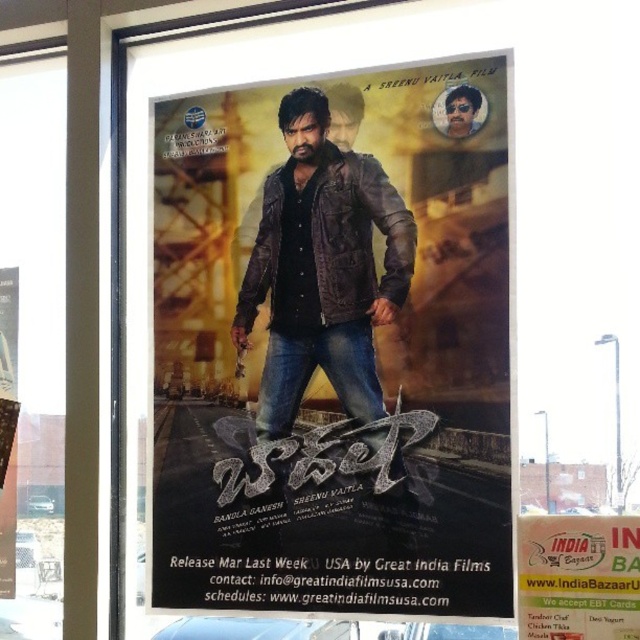
Is leather jacket at center taller than white paper sign at lower right?

Yes, leather jacket at center is taller than white paper sign at lower right.

Does leather jacket at center have a lesser width compared to white paper sign at lower right?

No.

Find the location of a particular element. This screenshot has width=640, height=640. leather jacket at center is located at coordinates (333, 348).

I want to click on leather jacket at center, so tap(333, 348).

Which is in front, point (324, 371) or point (612, 612)?

Positioned in front is point (612, 612).

Does brown leather jacket at center have a greater height compared to white paper sign at lower right?

Correct, brown leather jacket at center is much taller as white paper sign at lower right.

Is point (264, 392) behind point (572, 632)?

Yes.

I want to click on brown leather jacket at center, so click(323, 268).

Between point (276, 324) and point (316, 161), which one is positioned behind?

The point (276, 324) is more distant.

Is leather jacket at center positioned in front of brown leather jacket at center?

Yes.

What do you see at coordinates (333, 348) in the screenshot?
I see `leather jacket at center` at bounding box center [333, 348].

Find the location of a particular element. leather jacket at center is located at coordinates (333, 348).